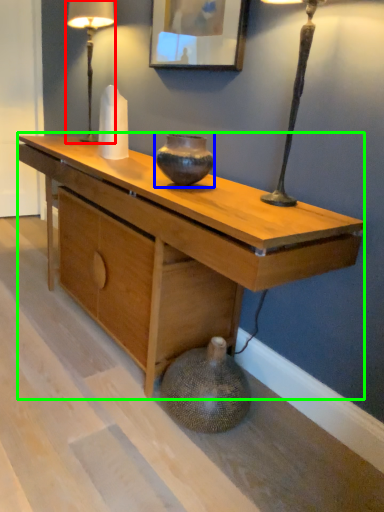
Question: Based on their relative distances, which object is farther from table lamp (highlighted by a red box)? Choose from vase (highlighted by a blue box) and desk (highlighted by a green box).

Choices:
 (A) vase
 (B) desk

Answer: (A)